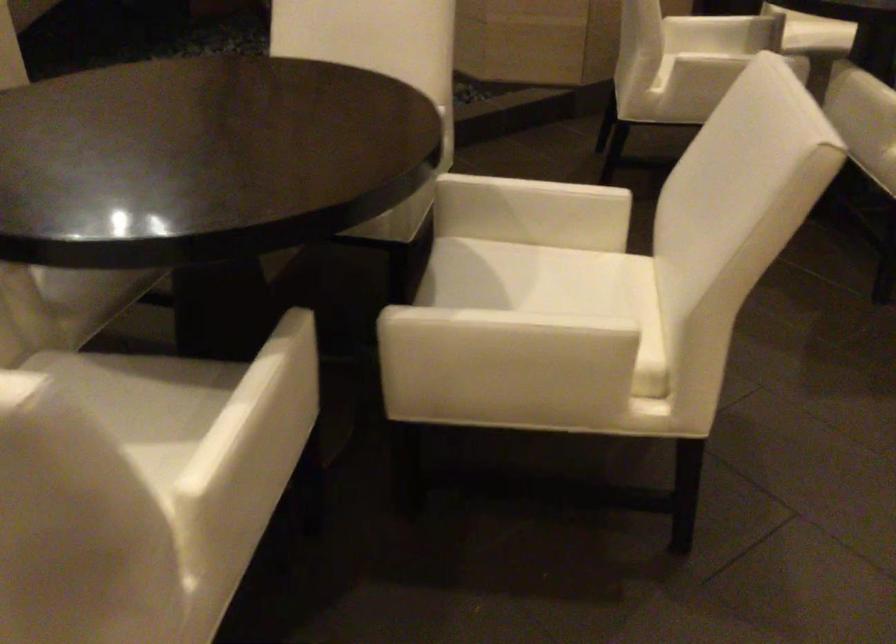
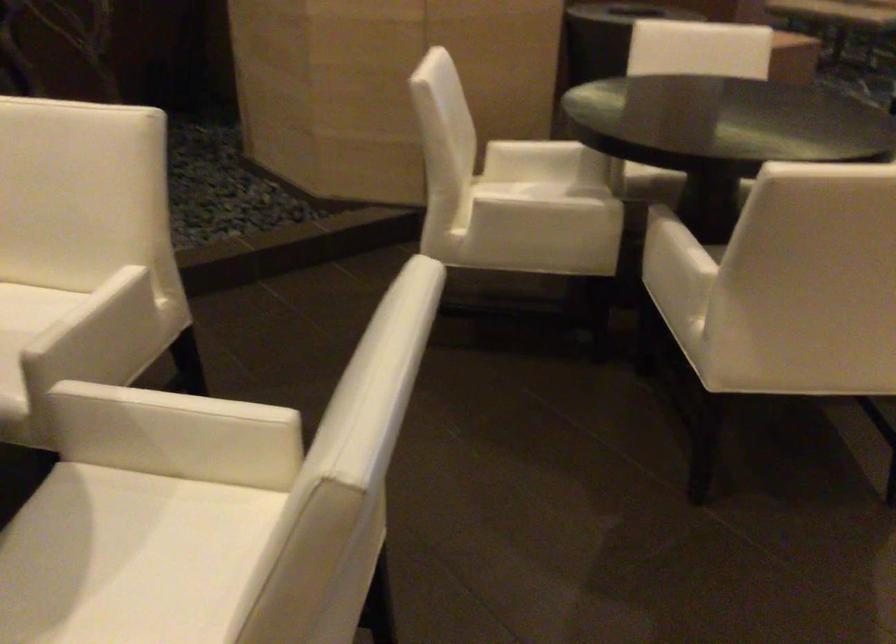
Find the pixel in the second image that matches pixel 522 285 in the first image.

(122, 558)